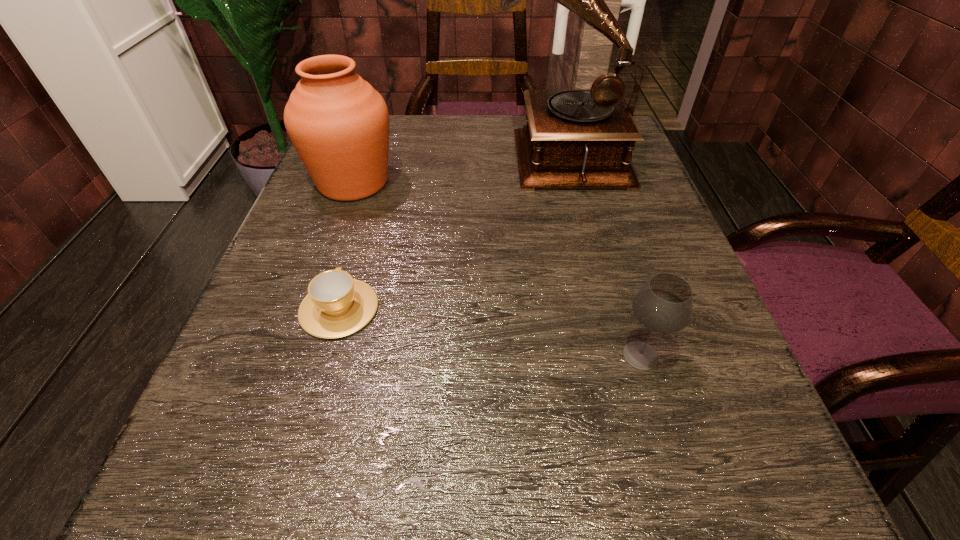
Locate an element on the screen. record player is located at coordinates (574, 138).

Locate an element on the screen. the second tallest object is located at coordinates (338, 123).

This screenshot has height=540, width=960. I want to click on the second shortest object, so click(664, 304).

The width and height of the screenshot is (960, 540). I want to click on cup, so click(336, 305).

Image resolution: width=960 pixels, height=540 pixels. In order to click on vacant space located on the horn of the record player in this screenshot , I will do `click(370, 153)`.

The width and height of the screenshot is (960, 540). I want to click on free location located 0.370m on the horn of the record player, so click(x=329, y=153).

You are a GUI agent. You are given a task and a screenshot of the screen. Output one action in this format:
    pyautogui.click(x=<x>, y=<y>)
    Task: Click on the vacant area situated 0.280m on the horn of the record player
    The height and width of the screenshot is (540, 960).
    Given the screenshot: What is the action you would take?
    tap(370, 153)

The width and height of the screenshot is (960, 540). Identify the location of vacant area located on the right of the third shortest object. (536, 183).

Where is `vacant space located 0.050m on the left of the second shortest object`? The height and width of the screenshot is (540, 960). vacant space located 0.050m on the left of the second shortest object is located at coordinates (579, 355).

Locate an element on the screen. vacant space positioned with the handle on the side of the cup is located at coordinates (363, 225).